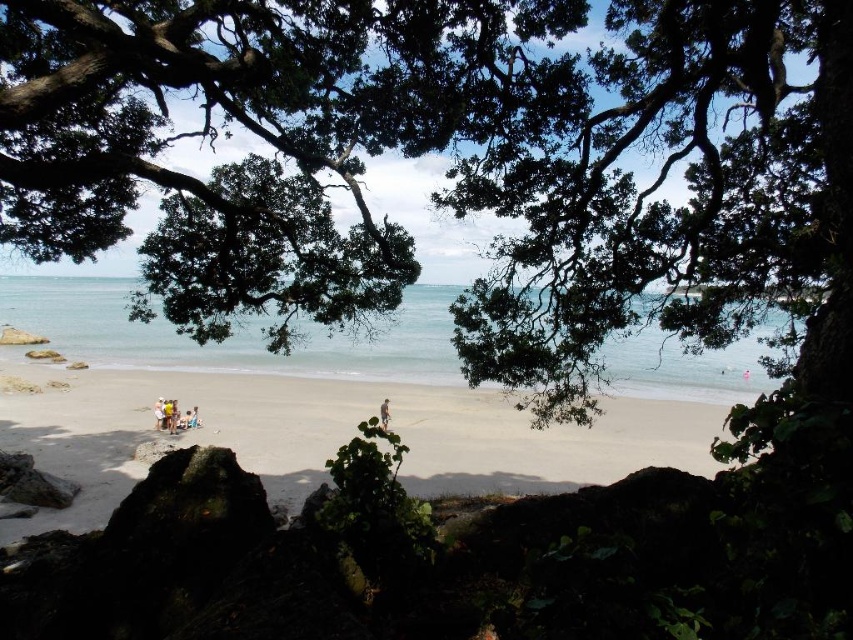
You are a GUI agent. You are given a task and a screenshot of the screen. Output one action in this format:
    pyautogui.click(x=<x>, y=<y>)
    Task: Click on the light brown wooden chair at lower left
    This screenshot has width=853, height=640.
    Given the screenshot: What is the action you would take?
    pyautogui.click(x=173, y=416)

Which is behind, point (154, 412) or point (155, 428)?

Positioned behind is point (154, 412).

Locate an element on the screen. light brown wooden chair at lower left is located at coordinates (173, 416).

From the picture: Is light brown sand at center further to the viewer compared to light brown wooden surfboard at center?

No, it is not.

Is light brown sand at center shorter than light brown wooden surfboard at center?

No.

Which is in front, point (525, 429) or point (381, 410)?

Positioned in front is point (381, 410).

Locate an element on the screen. This screenshot has width=853, height=640. light brown sand at center is located at coordinates (329, 435).

Which is below, green leafy tree at center or clear blue water at center?

clear blue water at center is lower down.

Who is taller, green leafy tree at center or clear blue water at center?

green leafy tree at center

Between point (164, 310) and point (352, 337), which one is positioned in front?

Point (164, 310) is more forward.

In order to click on green leafy tree at center in this screenshot , I will do `click(257, 134)`.